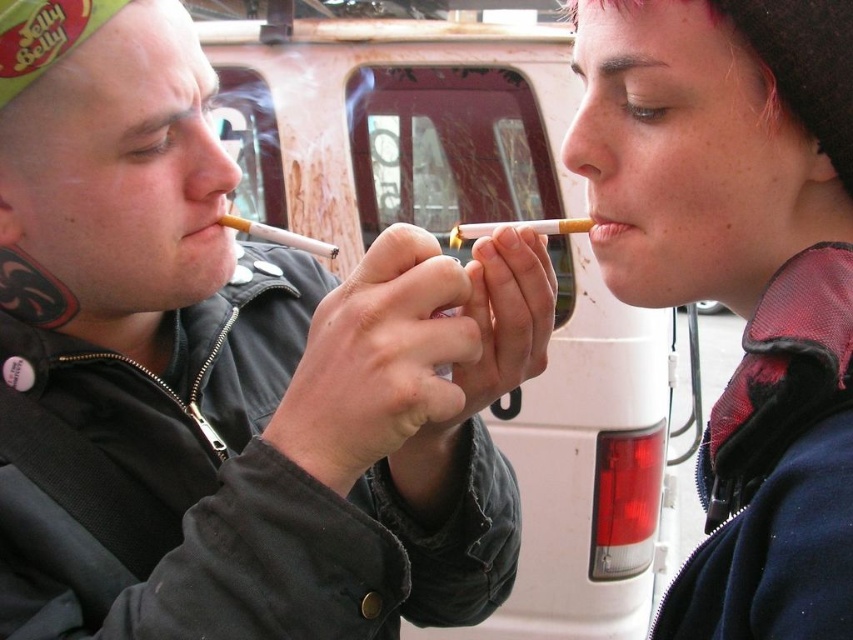
Question: Estimate the real-world distances between objects in this image. Which object is farther from the white matte cigarette at center?

Choices:
 (A) matte white cigarette at center
 (B) matte black jacket at upper right
 (C) matte pink lipstick at mouth

Answer: (B)

Question: Does white matte cigarette at center appear on the left side of matte pink lipstick at mouth?

Choices:
 (A) yes
 (B) no

Answer: (A)

Question: Is matte black jacket at center thinner than white matte cigarette at center?

Choices:
 (A) yes
 (B) no

Answer: (B)

Question: Which point is closer to the camera?

Choices:
 (A) (590, 227)
 (B) (606, 234)

Answer: (B)

Question: Can you confirm if white matte cigarette at center is positioned to the right of matte white cigarette at center?

Choices:
 (A) yes
 (B) no

Answer: (A)

Question: Which of the following is the farthest from the observer?

Choices:
 (A) matte black jacket at center
 (B) matte pink lipstick at mouth
 (C) matte black jacket at upper right

Answer: (B)